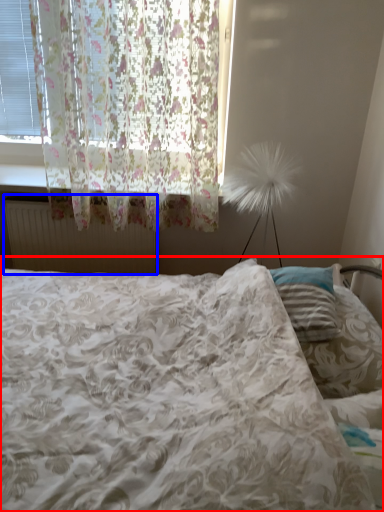
Question: Which point is closer to the camera, bed (highlighted by a red box) or radiator (highlighted by a blue box)?

Choices:
 (A) bed
 (B) radiator

Answer: (A)